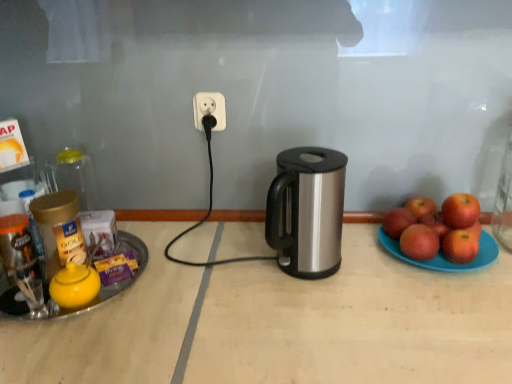
The height and width of the screenshot is (384, 512). I want to click on free space to the left of blue plastic plate at right, so click(x=359, y=266).